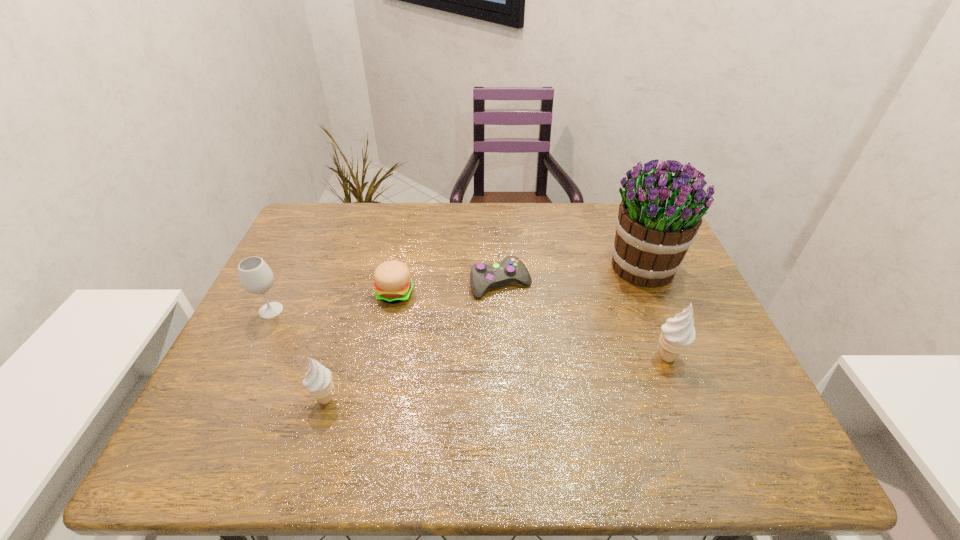
Identify the location of vacant space that satisfies the following two spatial constraints: 1. on the back side of the second shortest object; 2. on the left side of the leftmost object. (279, 293).

I want to click on vacant space that satisfies the following two spatial constraints: 1. on the front side of the fourth object from right to left; 2. on the front-facing side of the nearest object, so click(373, 400).